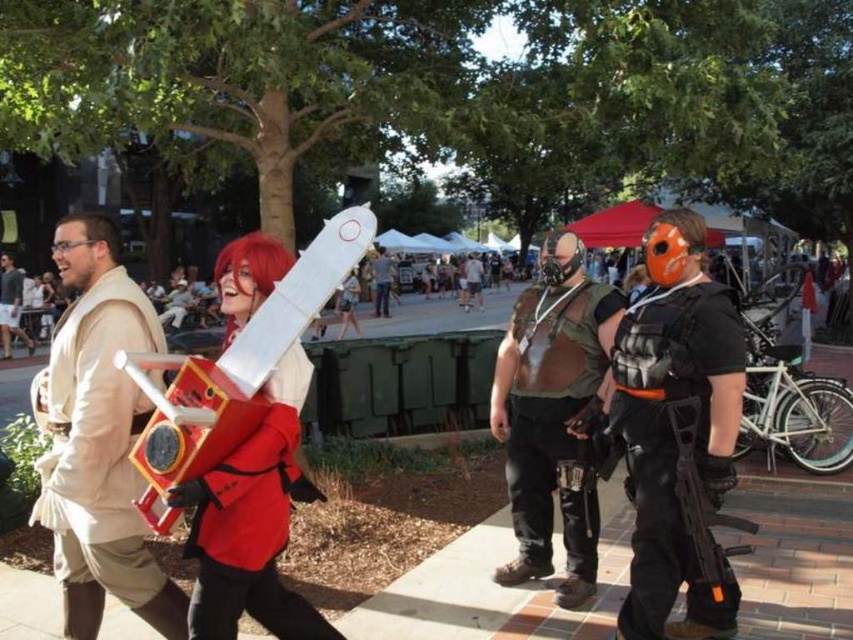
Question: Which of these objects is positioned farthest from the beige fabric coat at left?

Choices:
 (A) leather vest at center
 (B) black matte vest at right
 (C) red fabric jacket at center
 (D) matte black vest at center

Answer: (D)

Question: Among these objects, which one is nearest to the camera?

Choices:
 (A) beige fabric coat at left
 (B) black matte vest at right
 (C) matte black vest at center

Answer: (A)

Question: Can you confirm if black matte vest at right is wider than red fabric jacket at center?

Choices:
 (A) yes
 (B) no

Answer: (B)

Question: Does red fabric jacket at center have a lesser width compared to matte black vest at center?

Choices:
 (A) no
 (B) yes

Answer: (A)

Question: Based on their relative distances, which object is farther from the matte black vest at center?

Choices:
 (A) beige fabric coat at left
 (B) red fabric jacket at center
 (C) leather vest at center
 (D) black matte vest at right

Answer: (B)

Question: Does beige fabric coat at left have a greater width compared to leather vest at center?

Choices:
 (A) yes
 (B) no

Answer: (A)